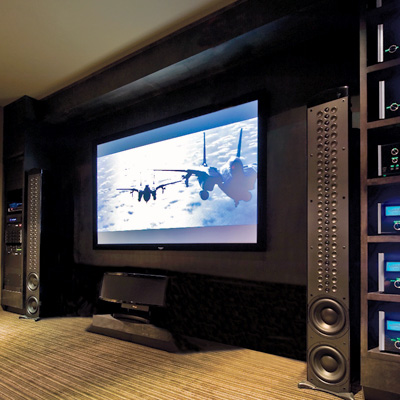
Locate an element on the screen. The image size is (400, 400). desktop is located at coordinates (64, 368).